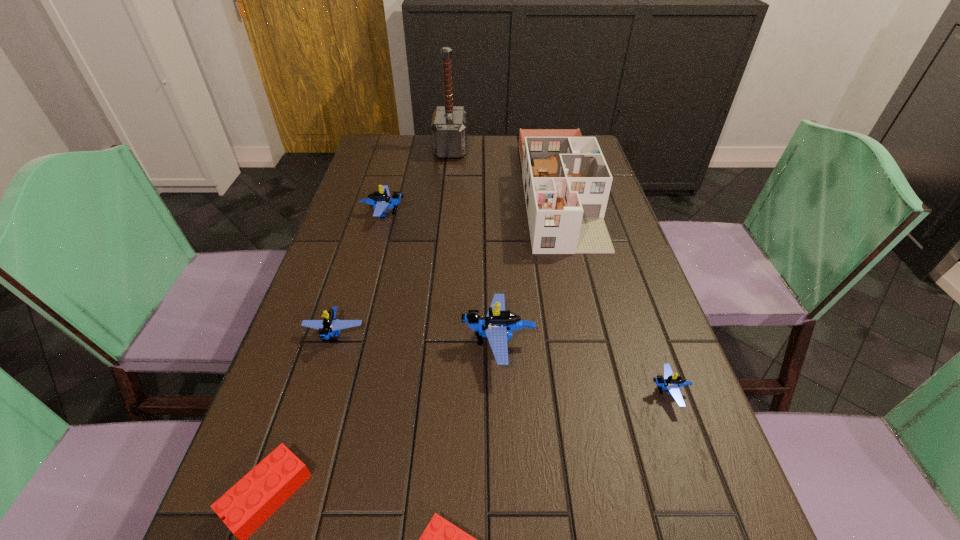
Identify the location of the sixth tallest object. Image resolution: width=960 pixels, height=540 pixels. (670, 382).

Find the location of a particular element. The image size is (960, 540). free space located on the right of the brown hammer is located at coordinates (564, 149).

The image size is (960, 540). Find the location of `vacant point located 0.350m at the front door of the white dollhouse`. vacant point located 0.350m at the front door of the white dollhouse is located at coordinates (602, 370).

In order to click on vacant region located 0.150m on the front-facing side of the third blue Lego from left to right in this screenshot , I will do `click(389, 343)`.

The height and width of the screenshot is (540, 960). I want to click on free space located on the front-facing side of the third blue Lego from left to right, so click(419, 343).

You are a GUI agent. You are given a task and a screenshot of the screen. Output one action in this format:
    pyautogui.click(x=<x>, y=<y>)
    Task: Click on the vacant space situated 0.100m on the front-facing side of the third blue Lego from left to right
    Image resolution: width=960 pixels, height=540 pixels.
    Given the screenshot: What is the action you would take?
    pyautogui.click(x=414, y=343)

In order to click on vacant space located on the front-facing side of the farthest blue Lego in this screenshot , I will do `click(524, 213)`.

Where is `vacant space located on the front-facing side of the second smallest blue Lego`? vacant space located on the front-facing side of the second smallest blue Lego is located at coordinates (298, 456).

At what (x,y) coordinates should I click in order to perform the action: click on free location located on the front-facing side of the third shortest object. Please return your answer as a coordinate pair (x, y). The image size is (960, 540). Looking at the image, I should click on (449, 392).

This screenshot has width=960, height=540. Identify the location of vacant space located 0.310m on the front-facing side of the third shortest object. (482, 392).